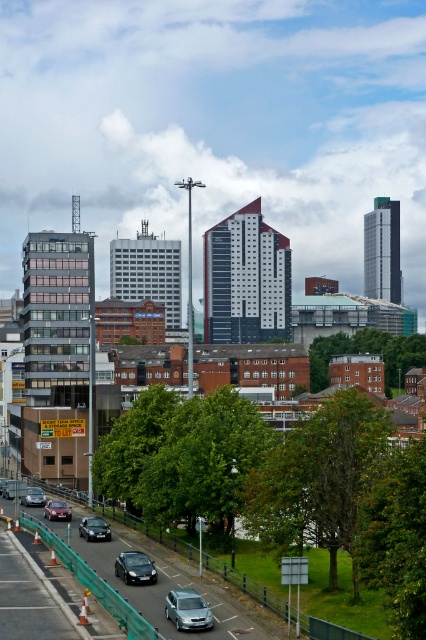
Question: Can you confirm if shiny black car at center is bigger than matte silver car at lower left?

Choices:
 (A) no
 (B) yes

Answer: (A)

Question: Which point appears closest to the camera in this image?

Choices:
 (A) (83, 528)
 (B) (32, 564)

Answer: (B)

Question: Can you confirm if silver metallic car at center is positioned to the right of metallic gray highway at lower left?

Choices:
 (A) no
 (B) yes

Answer: (B)

Question: Does shiny black car at center appear on the left side of shiny silver car at center?

Choices:
 (A) no
 (B) yes

Answer: (A)

Question: Considering the real-world distances, which object is closest to the satin silver car at lower center?

Choices:
 (A) matte silver car at lower left
 (B) silver metallic car at center
 (C) metallic gray highway at lower left

Answer: (C)

Question: Which object is farther from the camera taking this photo?

Choices:
 (A) matte silver car at lower left
 (B) shiny black car at lower left
 (C) satin silver car at lower center
 (D) metallic gray highway at lower left

Answer: (A)